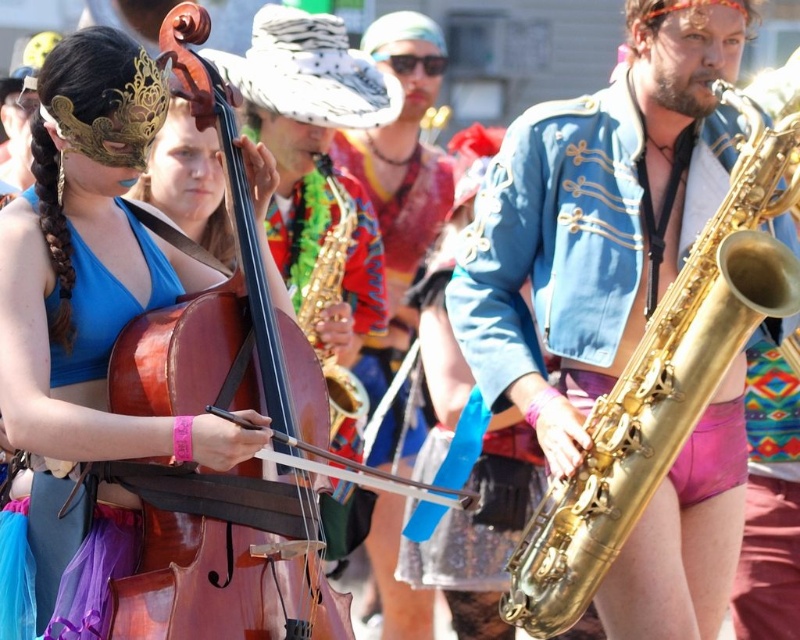
Question: Which of the following is the farthest from the observer?

Choices:
 (A) (113, 288)
 (B) (692, 406)

Answer: (B)

Question: Does wooden cello at left have a greater width compared to matte wood cello at left?

Choices:
 (A) yes
 (B) no

Answer: (B)

Question: Can you confirm if gold shiny saxophone at right is positioned above matte wood cello at left?

Choices:
 (A) yes
 (B) no

Answer: (A)

Question: Among these objects, which one is farthest from the camera?

Choices:
 (A) gold shiny saxophone at right
 (B) wooden cello at left

Answer: (A)

Question: Which point is closer to the camera?

Choices:
 (A) matte wood cello at left
 (B) wooden cello at left
 (C) gold shiny saxophone at right

Answer: (B)

Question: Is wooden cello at left below gold shiny saxophone at right?

Choices:
 (A) no
 (B) yes

Answer: (B)